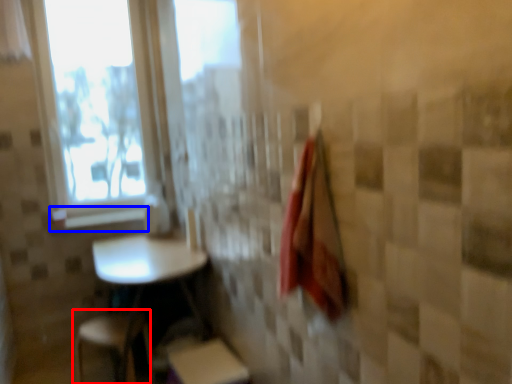
Question: Which point is closer to the camera, step stool (highlighted by a red box) or window sill (highlighted by a blue box)?

Choices:
 (A) step stool
 (B) window sill

Answer: (A)